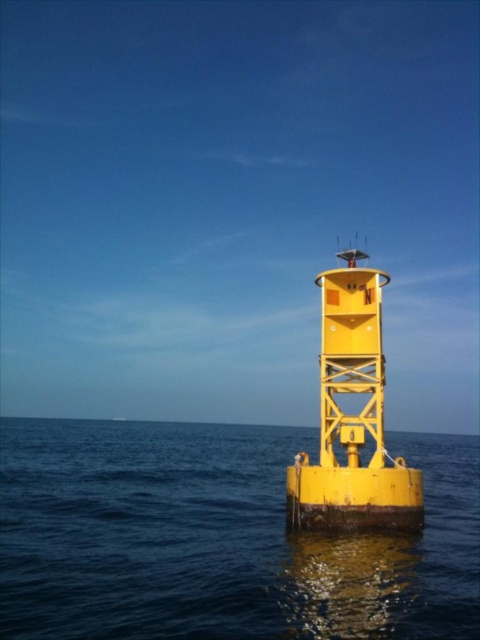
You are a boat captain navigating a vessel that is 25 meters long. You spot the smooth blue water at center and the metallic yellow buoy at center in the distance. Can your boat safely pass between them without touching either? Please explain your reasoning.

The smooth blue water at center and metallic yellow buoy at center are 24.16 meters apart. Since your boat is 25 meters long, it cannot safely pass between them as the distance is shorter than the boat length, risking collision with either object.

Consider the image. You are standing on the deck of a boat that is 10 meters long. You see a point marked at coordinates point (145, 460). If you want to navigate your boat so that the entire boat fits between the yellow buoy and the point, is this possible?

The distance between the yellow buoy and the point (145, 460) is 52.54 meters. Since the boat is only 10 meters long, there is sufficient space to fit the entire boat between them.